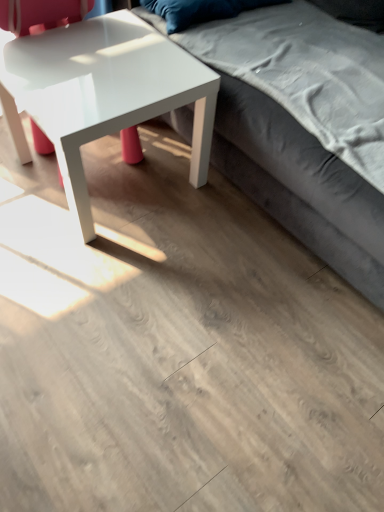
At what (x,y) coordinates should I click in order to perform the action: click on vacant point to the right of glossy white coffee table at left. Please return your answer as a coordinate pair (x, y). The width and height of the screenshot is (384, 512). Looking at the image, I should click on (219, 222).